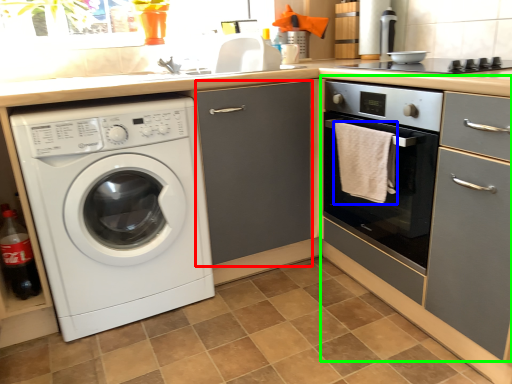
Question: Which object is positioned farthest from screen door (highlighted by a red box)? Select from bath towel (highlighted by a blue box) and cabinetry (highlighted by a green box).

Choices:
 (A) bath towel
 (B) cabinetry

Answer: (B)